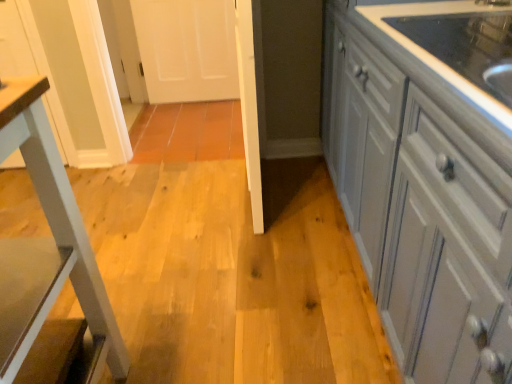
Question: In the image, is white glossy table leg at left positioned in front of or behind white glossy cabinets at right?

Choices:
 (A) behind
 (B) front

Answer: (A)

Question: Based on their positions, is white glossy table leg at left located to the left or right of white glossy cabinets at right?

Choices:
 (A) right
 (B) left

Answer: (B)

Question: Looking at their shapes, would you say white glossy table leg at left is wider or thinner than white glossy cabinets at right?

Choices:
 (A) thin
 (B) wide

Answer: (A)

Question: Is point (454, 372) closer or farther from the camera than point (31, 266)?

Choices:
 (A) farther
 (B) closer

Answer: (B)

Question: From a real-world perspective, is white glossy cabinets at right above or below white glossy table leg at left?

Choices:
 (A) below
 (B) above

Answer: (A)

Question: In terms of size, does white glossy cabinets at right appear bigger or smaller than white glossy table leg at left?

Choices:
 (A) small
 (B) big

Answer: (B)

Question: Considering the relative positions of white glossy cabinets at right and white glossy table leg at left in the image provided, is white glossy cabinets at right to the left or to the right of white glossy table leg at left?

Choices:
 (A) left
 (B) right

Answer: (B)